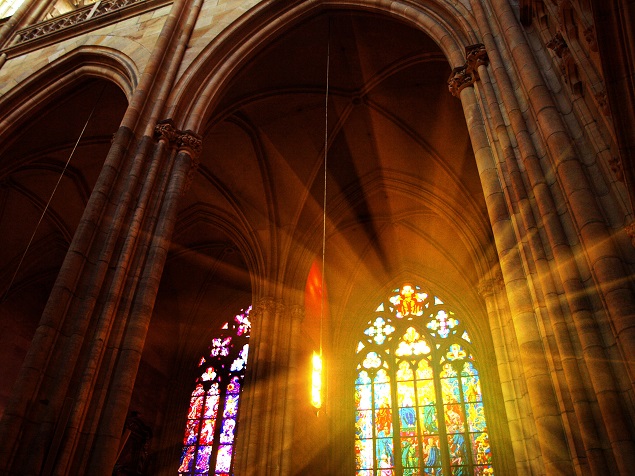
Where is `stained glass window, left of centr`? Image resolution: width=635 pixels, height=476 pixels. stained glass window, left of centr is located at coordinates 217,405.